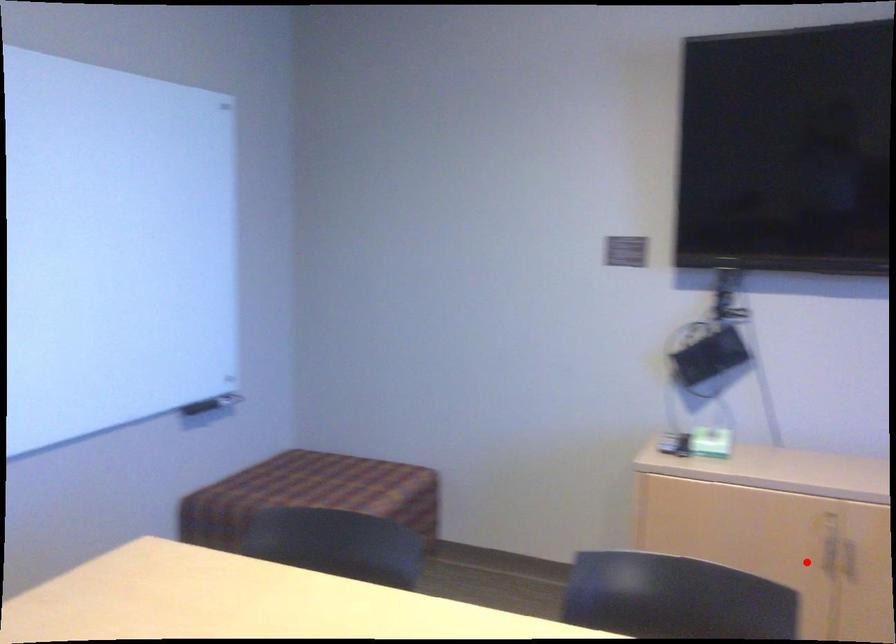
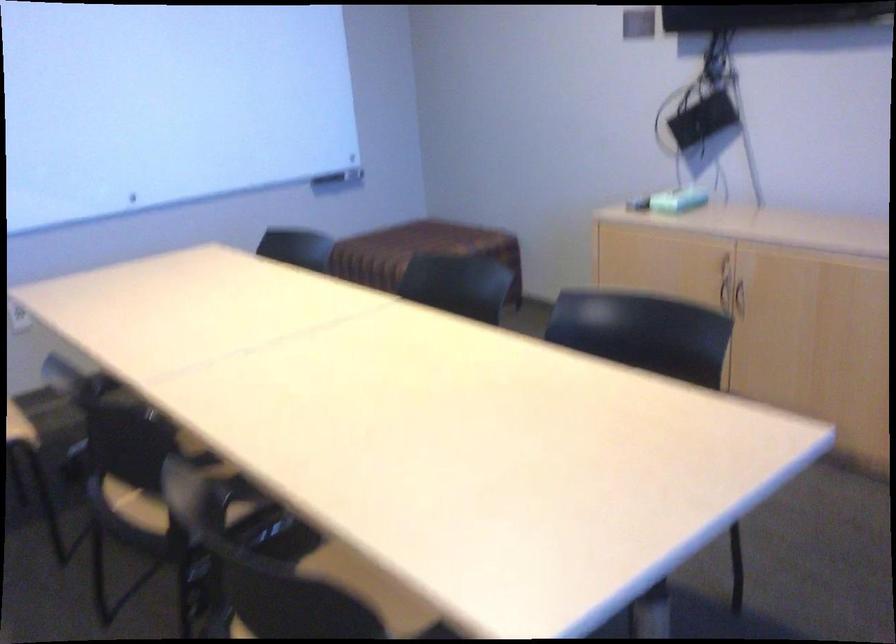
Question: I am providing you with two images of the same scene from different viewpoints. A red point is marked on the first image. Is the red point's position out of view in image 2?

Choices:
 (A) Yes
 (B) No

Answer: (B)